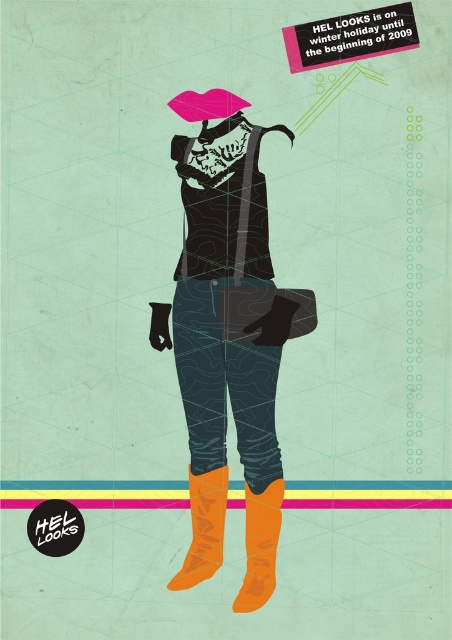
You are an artist designing a layout for a poster. You need to place both the orange suede boot at lower right and the orange matte boot at lower center in a way that the smaller one doesn not overlap the larger one. Which boot should you place first to ensure proper positioning?

The orange suede boot at lower right occupies less space than the orange matte boot at lower center, so you should place the orange suede boot at lower right first to ensure it doesn not get covered by the larger boot.